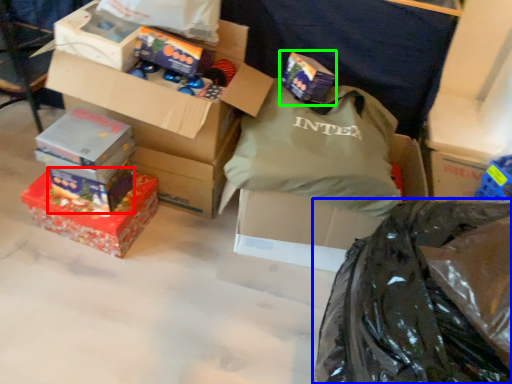
Question: Which object is the farthest from box (highlighted by a red box)? Choose among these: plastic bag (highlighted by a blue box) or gift (highlighted by a green box).

Choices:
 (A) plastic bag
 (B) gift

Answer: (A)